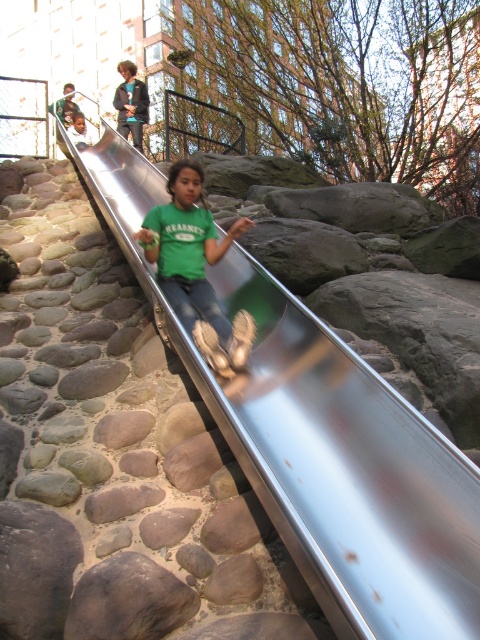
Question: Which point is farther to the camera?

Choices:
 (A) green matte shirt at center
 (B) metallic smooth slide at center

Answer: (A)

Question: Can you confirm if metallic smooth slide at center is wider than green matte shirt at center?

Choices:
 (A) no
 (B) yes

Answer: (A)

Question: Among these points, which one is farthest from the camera?

Choices:
 (A) (151, 259)
 (B) (273, 340)

Answer: (A)

Question: Does metallic smooth slide at center have a smaller size compared to green matte shirt at center?

Choices:
 (A) yes
 (B) no

Answer: (A)

Question: Can you confirm if metallic smooth slide at center is smaller than green matte shirt at center?

Choices:
 (A) no
 (B) yes

Answer: (B)

Question: Among these objects, which one is nearest to the camera?

Choices:
 (A) green matte shirt at center
 (B) metallic smooth slide at center

Answer: (B)